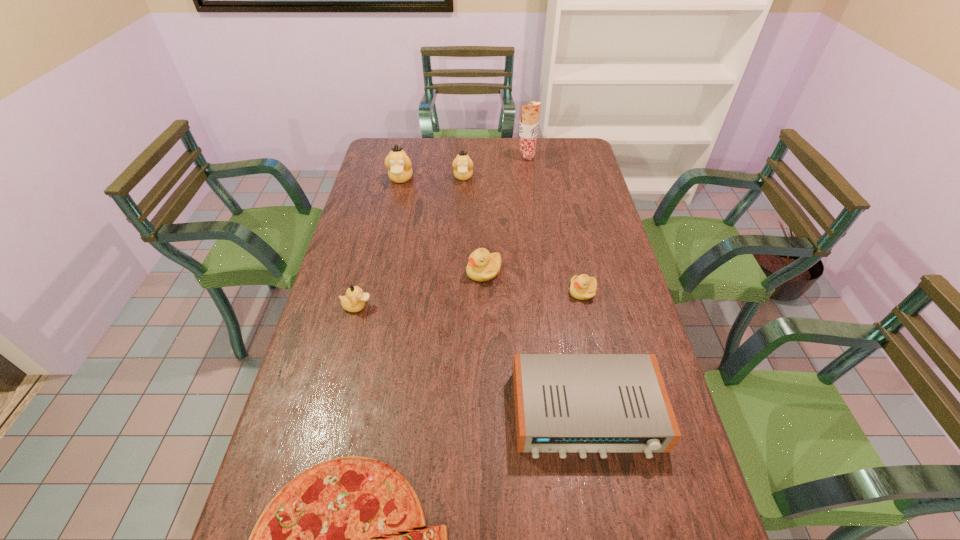
This screenshot has width=960, height=540. In order to click on vacant space situated on the beak of the smaller yellow duckling in this screenshot , I will do `click(546, 292)`.

Locate an element on the screen. The width and height of the screenshot is (960, 540). vacant area located on the beak of the smaller yellow duckling is located at coordinates (553, 292).

Find the location of a particular element. Image resolution: width=960 pixels, height=540 pixels. object positioned at the far edge is located at coordinates (528, 127).

Locate an element on the screen. This screenshot has height=540, width=960. radio receiver at the right edge is located at coordinates (582, 403).

At what (x,y) coordinates should I click in order to perform the action: click on duckling situated at the right edge. Please return your answer as a coordinate pair (x, y). This screenshot has height=540, width=960. Looking at the image, I should click on (583, 287).

You are a GUI agent. You are given a task and a screenshot of the screen. Output one action in this format:
    pyautogui.click(x=<x>, y=<y>)
    Task: Click on the blank area at the far edge
    This screenshot has width=960, height=540.
    Given the screenshot: What is the action you would take?
    pyautogui.click(x=507, y=147)

Identify the location of free space at the left edge. Image resolution: width=960 pixels, height=540 pixels. (346, 401).

Image resolution: width=960 pixels, height=540 pixels. Find the location of `vacant space at the right edge of the desktop`. vacant space at the right edge of the desktop is located at coordinates (588, 211).

Where is `free space between the nearest tan duckling and the seventh tallest object`? This screenshot has width=960, height=540. free space between the nearest tan duckling and the seventh tallest object is located at coordinates (469, 299).

Locate an element on the screen. This screenshot has height=540, width=960. vacant space in between the smallest tan duckling and the second biggest tan duckling is located at coordinates (410, 242).